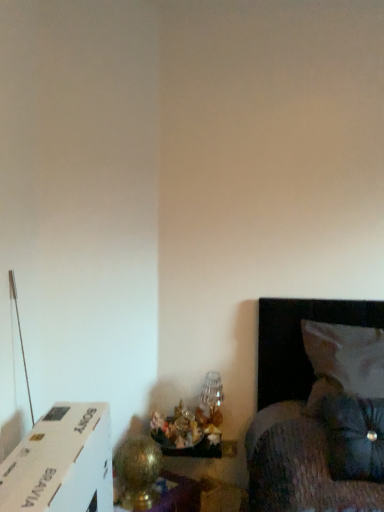
Question: Is translucent glass vase at lower center, the first table lamp when ordered from right to left, taller or shorter than velvety black pillow at lower right, which is the 1th pillow from front to back?

Choices:
 (A) short
 (B) tall

Answer: (A)

Question: From the image's perspective, relative to velvety black pillow at lower right, which is the 1th pillow from front to back, is translucent glass vase at lower center, which ranks as the first table lamp in back-to-front order, above or below?

Choices:
 (A) above
 (B) below

Answer: (B)

Question: Which is nearer to the gold metallic table lamp at lower left, the 1th table lamp viewed from the left?

Choices:
 (A) velvety black pillow at lower right, which is the 1th pillow from front to back
 (B) translucent glass vase at lower center, which ranks as the first table lamp in back-to-front order
 (C) white fabric pillow at right, the second pillow in the front-to-back sequence

Answer: (B)

Question: Which object is the closest to the translucent glass vase at lower center, the first table lamp when ordered from right to left?

Choices:
 (A) white fabric pillow at right, the second pillow in the front-to-back sequence
 (B) gold metallic table lamp at lower left, the 1th table lamp in the front-to-back sequence
 (C) velvety black pillow at lower right, which is the 1th pillow from front to back

Answer: (B)